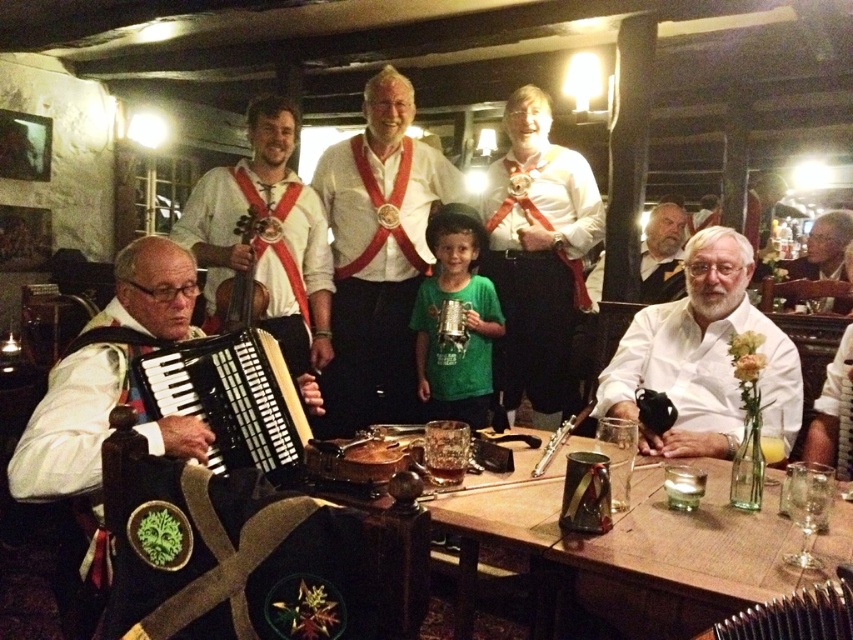
Consider the image. You are a bartender at this pub and need to place a new drink order between the white cotton shirt at center and the white shirt with red sash at center. The drink is 15 inches wide. Will there be enough space?

The white cotton shirt at center and white shirt with red sash at center are 17.49 inches apart, so yes, the drink which is 15 inches wide can fit between them since the space is wider than the drink.